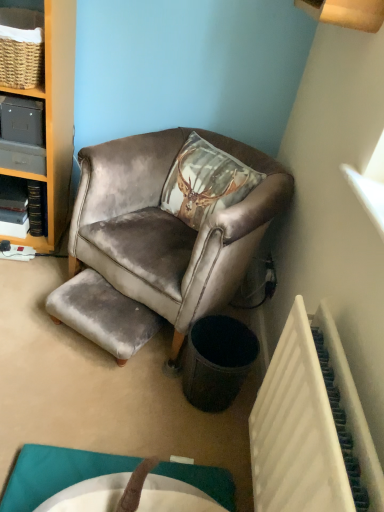
Question: Does matte gray cabinet at left come in front of velvet grey stool at lower left?

Choices:
 (A) no
 (B) yes

Answer: (A)

Question: From the image's perspective, does matte gray cabinet at left appear lower than velvet grey stool at lower left?

Choices:
 (A) yes
 (B) no

Answer: (B)

Question: Considering the relative sizes of matte gray cabinet at left and velvet grey stool at lower left in the image provided, is matte gray cabinet at left shorter than velvet grey stool at lower left?

Choices:
 (A) yes
 (B) no

Answer: (A)

Question: From a real-world perspective, is matte gray cabinet at left physically below velvet grey stool at lower left?

Choices:
 (A) no
 (B) yes

Answer: (A)

Question: Is matte gray cabinet at left at the right side of velvet grey stool at lower left?

Choices:
 (A) no
 (B) yes

Answer: (A)

Question: Is white plastic radiator at lower right inside the boundaries of black textured trash bin at lower right, or outside?

Choices:
 (A) outside
 (B) inside

Answer: (A)

Question: In terms of height, does white plastic radiator at lower right look taller or shorter compared to black textured trash bin at lower right?

Choices:
 (A) tall
 (B) short

Answer: (A)

Question: Considering their positions, is white plastic radiator at lower right located in front of or behind black textured trash bin at lower right?

Choices:
 (A) behind
 (B) front

Answer: (B)

Question: Is point (289, 479) positioned closer to the camera than point (226, 402)?

Choices:
 (A) closer
 (B) farther

Answer: (A)

Question: Is velvet grey stool at lower left wider or thinner than white plastic radiator at lower right?

Choices:
 (A) thin
 (B) wide

Answer: (B)

Question: In the image, is velvet grey stool at lower left positioned in front of or behind white plastic radiator at lower right?

Choices:
 (A) behind
 (B) front

Answer: (A)

Question: From the image's perspective, relative to white plastic radiator at lower right, is velvet grey stool at lower left above or below?

Choices:
 (A) below
 (B) above

Answer: (B)

Question: In terms of size, does velvet grey stool at lower left appear bigger or smaller than white plastic radiator at lower right?

Choices:
 (A) small
 (B) big

Answer: (A)

Question: Visually, is velvet brown armchair at center positioned to the left or to the right of matte gray cabinet at left?

Choices:
 (A) left
 (B) right

Answer: (B)

Question: From the image's perspective, is velvet brown armchair at center positioned above or below matte gray cabinet at left?

Choices:
 (A) below
 (B) above

Answer: (A)